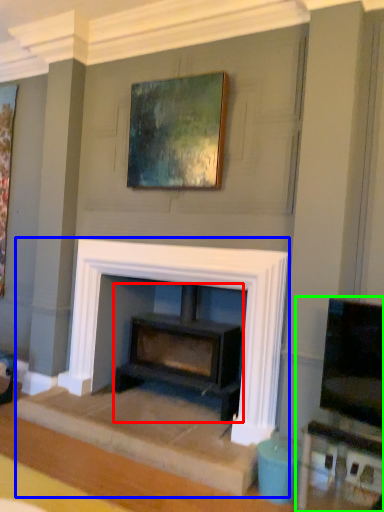
Question: Considering the real-world distances, which object is farthest from wood burning stove (highlighted by a red box)? fireplace (highlighted by a blue box) or entertainment center (highlighted by a green box)?

Choices:
 (A) fireplace
 (B) entertainment center

Answer: (B)